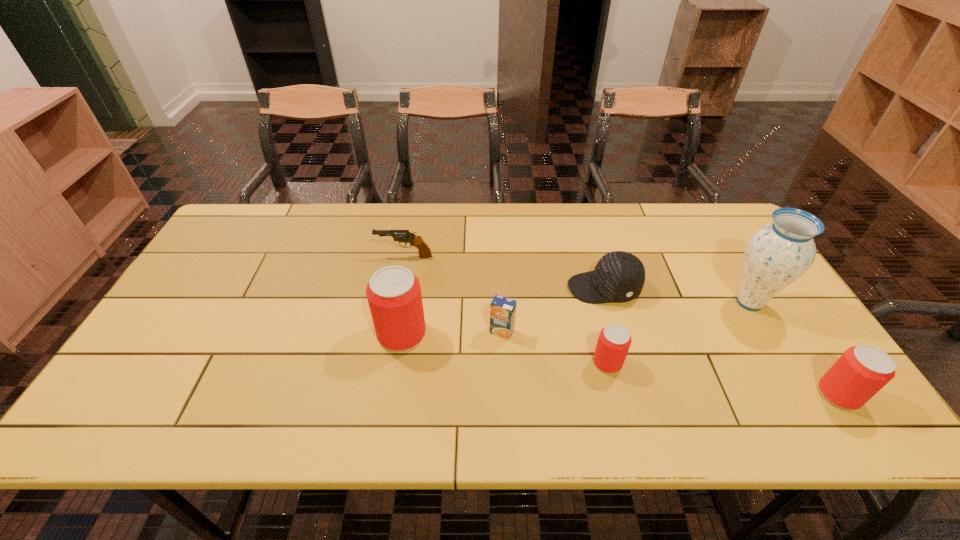
Locate an element on the screen. free space located on the right of the shortest beer can is located at coordinates (672, 362).

Find the location of a particular element. This screenshot has width=960, height=540. vacant region located 0.150m on the left of the nearest object is located at coordinates (754, 394).

Find the location of `vacant space located 0.330m along the barrel of the farthest object`. vacant space located 0.330m along the barrel of the farthest object is located at coordinates (270, 256).

Identify the location of blank space located 0.300m along the barrel of the farthest object. This screenshot has height=540, width=960. (279, 256).

Identify the location of vacant space located along the barrel of the farthest object. (342, 256).

Locate an element on the screen. The height and width of the screenshot is (540, 960). free space located on the left of the vase is located at coordinates (658, 302).

At what (x,y) coordinates should I click in order to perform the action: click on free space located at the front of the baseball cap where the brim is located. Please return your answer as a coordinate pair (x, y). This screenshot has width=960, height=540. Looking at the image, I should click on (493, 288).

The width and height of the screenshot is (960, 540). I want to click on vacant space located at the front of the baseball cap where the brim is located, so pyautogui.click(x=529, y=288).

The height and width of the screenshot is (540, 960). In order to click on free region located 0.340m at the front of the baseball cap where the brim is located in this screenshot , I will do `click(448, 288)`.

Find the location of a particular element. free space located on the right of the third object from left to right is located at coordinates (623, 332).